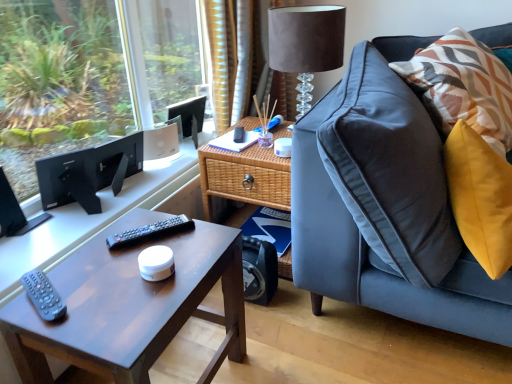
Image resolution: width=512 pixels, height=384 pixels. I want to click on free spot in front of black matte computer monitor at left, so click(51, 238).